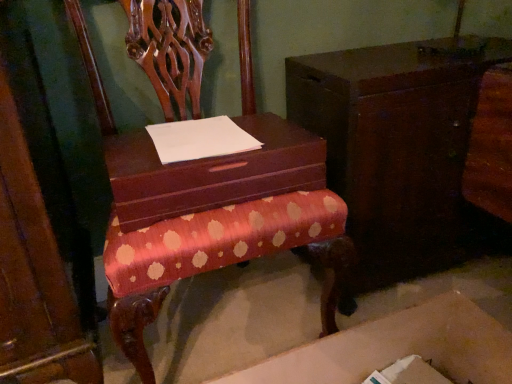
Question: From a real-world perspective, is matte brown shoe box at center physically above white paper at center?

Choices:
 (A) no
 (B) yes

Answer: (A)

Question: From the image's perspective, is matte brown shoe box at center beneath white paper at center?

Choices:
 (A) no
 (B) yes

Answer: (B)

Question: Can you confirm if matte brown shoe box at center is positioned to the right of white paper at center?

Choices:
 (A) no
 (B) yes

Answer: (B)

Question: Can you confirm if matte brown shoe box at center is taller than white paper at center?

Choices:
 (A) yes
 (B) no

Answer: (A)

Question: Can you confirm if matte brown shoe box at center is positioned to the left of white paper at center?

Choices:
 (A) yes
 (B) no

Answer: (B)

Question: Is wooden cabinet at center wider or thinner than matte brown shoe box at center?

Choices:
 (A) thin
 (B) wide

Answer: (B)

Question: Is wooden cabinet at center inside or outside of matte brown shoe box at center?

Choices:
 (A) inside
 (B) outside

Answer: (B)

Question: Would you say wooden cabinet at center is to the left or to the right of matte brown shoe box at center in the picture?

Choices:
 (A) right
 (B) left

Answer: (A)

Question: Is point pos(438,155) closer or farther from the camera than point pos(221,183)?

Choices:
 (A) farther
 (B) closer

Answer: (A)

Question: Is matte brown shoe box at center bigger or smaller than white paper at center?

Choices:
 (A) small
 (B) big

Answer: (B)

Question: From the image's perspective, is matte brown shoe box at center positioned above or below white paper at center?

Choices:
 (A) above
 (B) below

Answer: (B)

Question: Relative to white paper at center, is matte brown shoe box at center in front or behind?

Choices:
 (A) behind
 (B) front

Answer: (B)

Question: Considering the positions of matte brown shoe box at center and white paper at center in the image, is matte brown shoe box at center taller or shorter than white paper at center?

Choices:
 (A) short
 (B) tall

Answer: (B)

Question: In the image, is matte brown shoe box at center positioned in front of or behind cardboard box at lower center?

Choices:
 (A) front
 (B) behind

Answer: (B)

Question: From a real-world perspective, is matte brown shoe box at center physically located above or below cardboard box at lower center?

Choices:
 (A) above
 (B) below

Answer: (A)